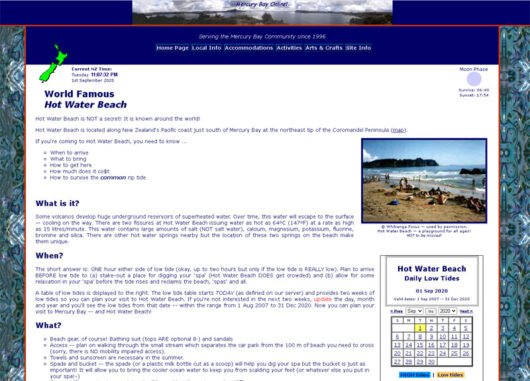
You are a GUI agent. You are given a task and a screenshot of the screen. Output one action in this format:
    pyautogui.click(x=<x>, y=<y>)
    Task: Click on the pictures
    
    Given the screenshot: What is the action you would take?
    pyautogui.click(x=429, y=164)